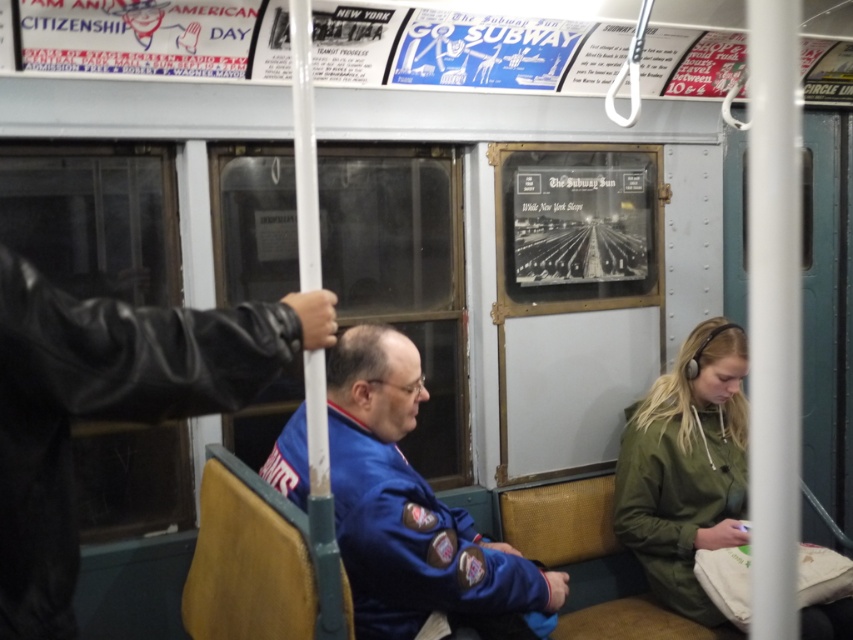
You are a passenger standing in the subway car and want to sit down. There are two seats available next to the leather jacket at left and the blue fabric jacket at center. Which seat is closer to the left side of the subway car?

The leather jacket at left is to the left of blue fabric jacket at center, so the seat next to the leather jacket at left is closer to the left side of the subway car.

You are a passenger in the subway car and want to know the position of the blue fabric jacket at center and the green matte jacket at lower right. Which one is located to the left?

The blue fabric jacket at center is to the left of the green matte jacket at lower right.